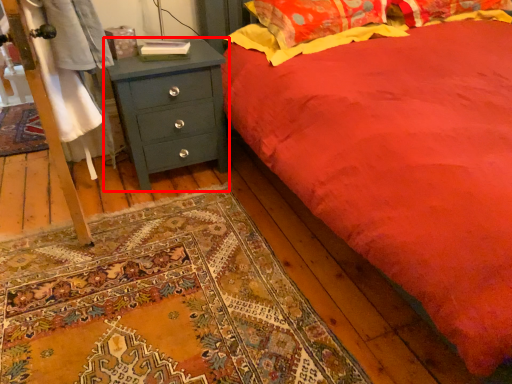
Question: Observing the image, what is the correct spatial positioning of chest of drawers (annotated by the red box) in reference to pillow?

Choices:
 (A) right
 (B) left

Answer: (B)